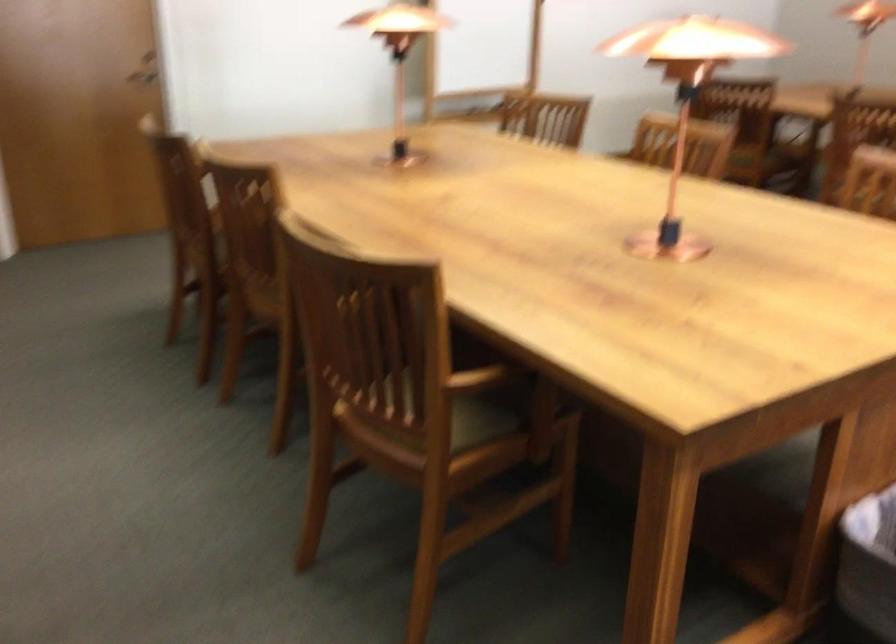
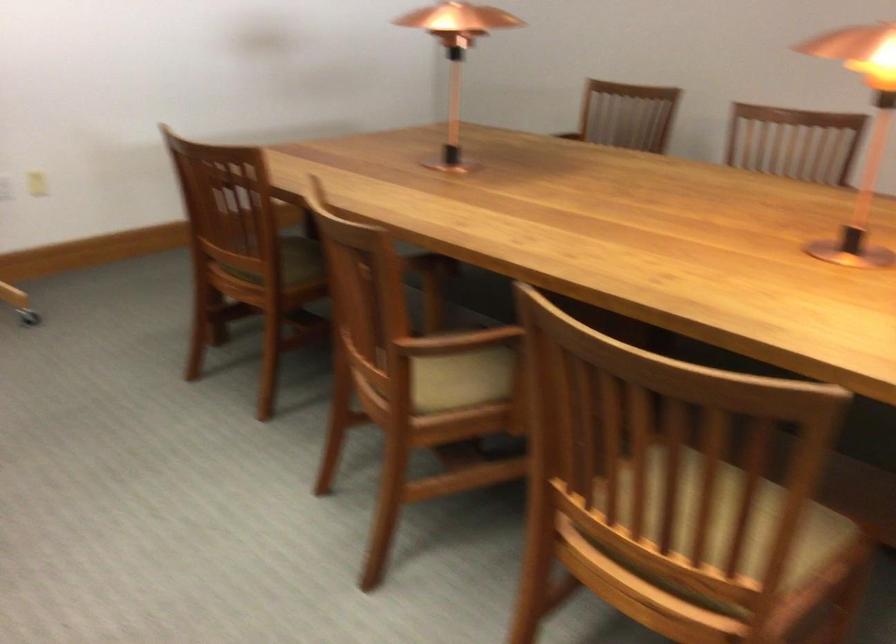
Question: I am providing you with two images of the same scene from different viewpoints. Please identify which objects are invisible in image2.

Choices:
 (A) wall light switch
 (B) beige chair sitting surface
 (C) caster wheel
 (D) none of these

Answer: (D)